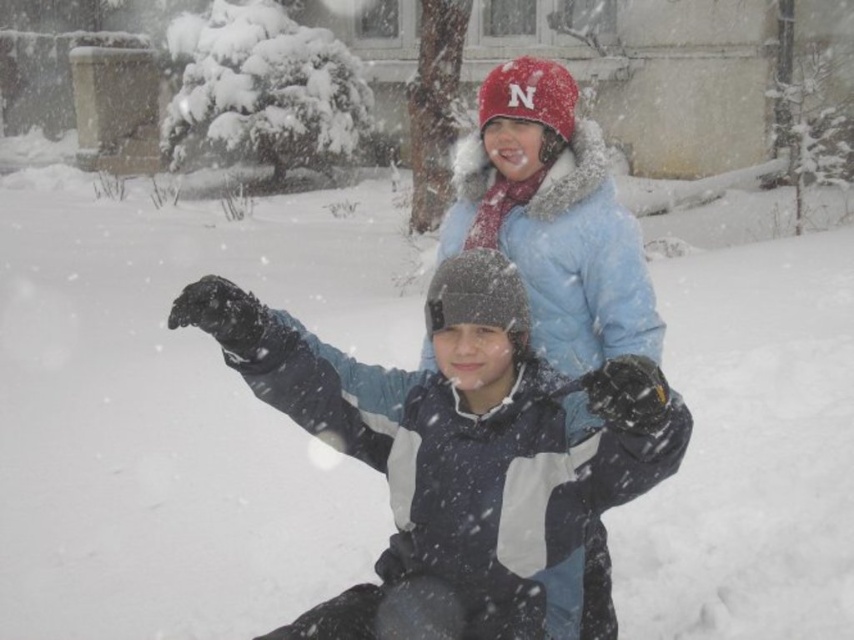
You are a parent looking for your two children playing in the snow. You see the matte black jacket at center and the light blue down jacket at upper center. Which child is more to the left?

The matte black jacket at center is more to the left than the light blue down jacket at upper center.

You are a parent trying to locate your children in the snow. You see a matte black jacket at center and another child. How far apart are the two children?

The two children are 2.19 meters apart.